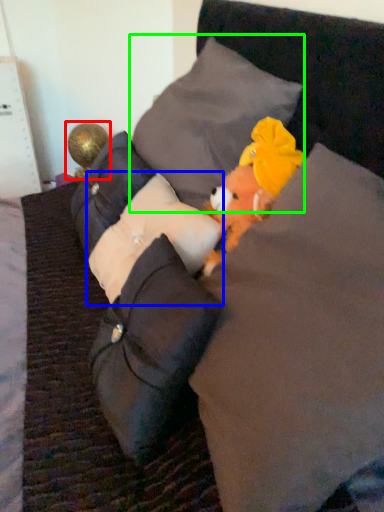
Question: Which object is positioned closest to toy (highlighted by a red box)? Select from pillow (highlighted by a blue box) and pillow (highlighted by a green box).

Choices:
 (A) pillow
 (B) pillow

Answer: (B)